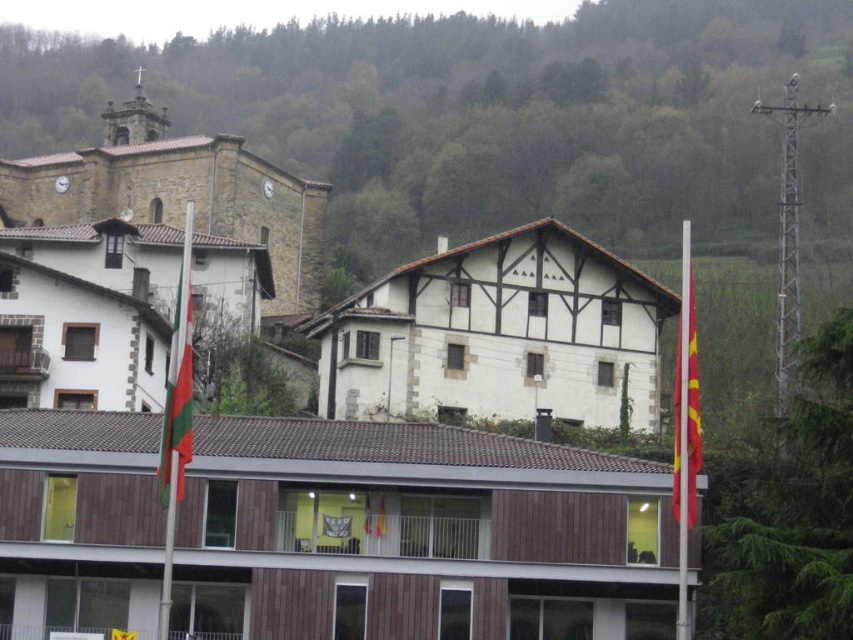
You are planning to place a new bench in the town square. The bench needs to be placed between the white wood house at center and the white wood hotel at upper left. Given their widths, which building should the bench be closer to for it to fit better?

The bench should be placed closer to the white wood hotel at upper left because the white wood house at center is wider, so positioning the bench near the narrower white wood hotel at upper left would allow better spacing.

You are standing in the town square and want to go to the white wood house at center. From your current position, which direction should you move relative to the white wood hotel at upper left?

The white wood house at center is located below the white wood hotel at upper left, so you should move downward from the white wood hotel at upper left to reach the white wood house at center.